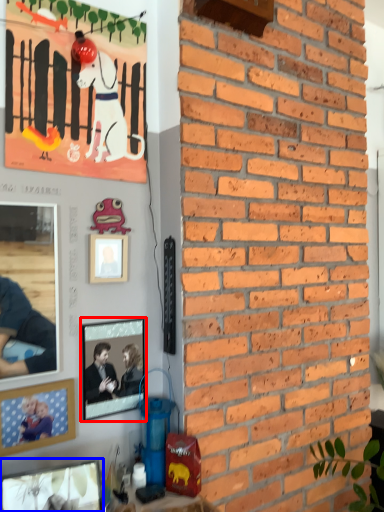
Question: Which of the following is the farthest to the observer, picture frame (highlighted by a red box) or picture frame (highlighted by a blue box)?

Choices:
 (A) picture frame
 (B) picture frame

Answer: (A)